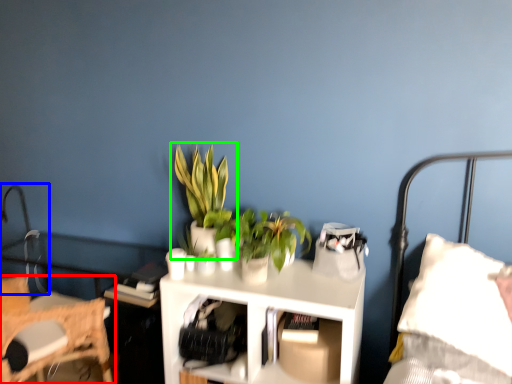
Question: Which object is positioned closest to chair (highlighted by a red box)? Select from table lamp (highlighted by a blue box) and houseplant (highlighted by a green box).

Choices:
 (A) table lamp
 (B) houseplant

Answer: (B)